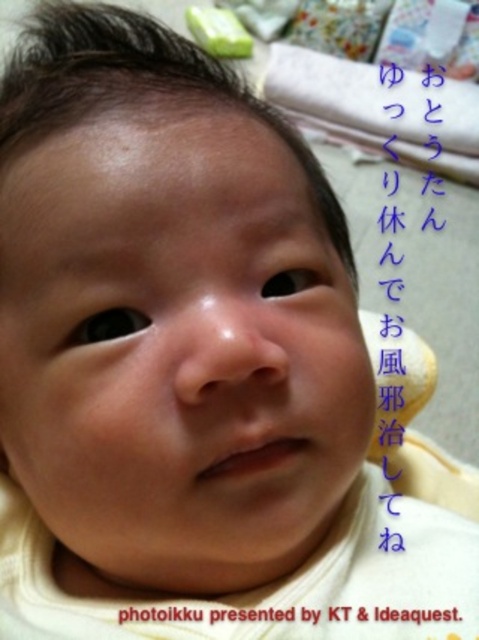
Is point (179, 616) behind point (197, 22)?

No, it is not.

Is black paper at upper center to the right of green rubber toy at upper center from the viewer's perspective?

Correct, you'll find black paper at upper center to the right of green rubber toy at upper center.

This screenshot has width=479, height=640. Describe the element at coordinates (286, 614) in the screenshot. I see `black paper at upper center` at that location.

You are a GUI agent. You are given a task and a screenshot of the screen. Output one action in this format:
    pyautogui.click(x=<x>, y=<y>)
    Task: Click on the black paper at upper center
    
    Given the screenshot: What is the action you would take?
    pyautogui.click(x=286, y=614)

Find the location of a particular element. This screenshot has width=479, height=640. blue paper at upper right is located at coordinates (405, 410).

Does point (379, 406) lie in front of point (234, 22)?

Yes, it is.

Locate an element on the screen. This screenshot has width=479, height=640. blue paper at upper right is located at coordinates (405, 410).

Consider the image. Which is more to the left, blue paper at upper right or black paper at upper center?

Positioned to the left is black paper at upper center.

Is blue paper at upper right closer to the viewer compared to black paper at upper center?

No.

Is point (407, 422) positioned before point (392, 620)?

No, (407, 422) is behind (392, 620).

Image resolution: width=479 pixels, height=640 pixels. I want to click on blue paper at upper right, so click(x=405, y=410).